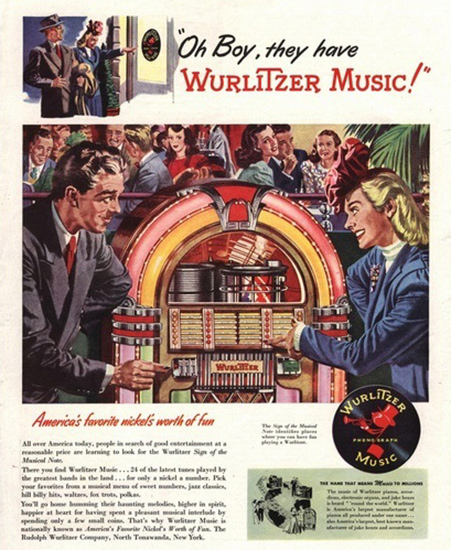
Locate an element on the screen. The width and height of the screenshot is (451, 550). door is located at coordinates (150, 75).